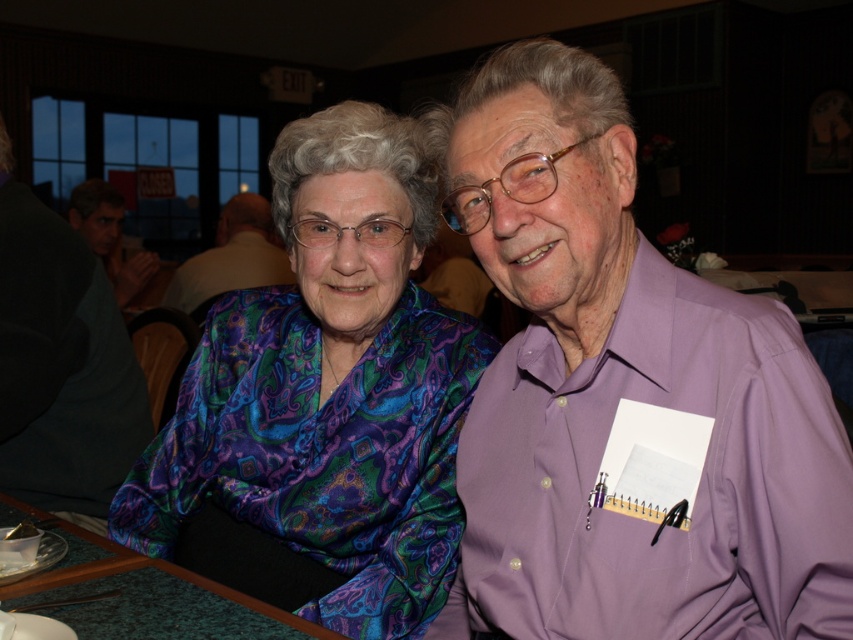
You are standing at the origin point in the image and want to move towards the two points labeled as point (373, 524) and point (138, 582). Which point should you approach first if you want to reach the one that is closer to you?

Point (138, 582) is closer to the origin point, so you should approach it first.

You are a photographer adjusting your camera settings. You need to focus on the multicolored paisley blouse at center and the green felt table at lower left. Which object should you adjust your focus to first if you want to capture both in sharp detail?

You should focus on the multicolored paisley blouse at center first because it is closer to the viewer than the green felt table at lower left, allowing for better depth of field when capturing both objects.

You are at a social event and want to introduce yourself to both people. Which person should you approach first if you want to greet the person wearing the dark gray shirt at left and the matte black shirt at upper left in the order they are positioned from left to right?

The matte black shirt at upper left is positioned to the left of the dark gray shirt at left. Therefore, you should approach the matte black shirt at upper left first, followed by the dark gray shirt at left to greet them in left to right order.